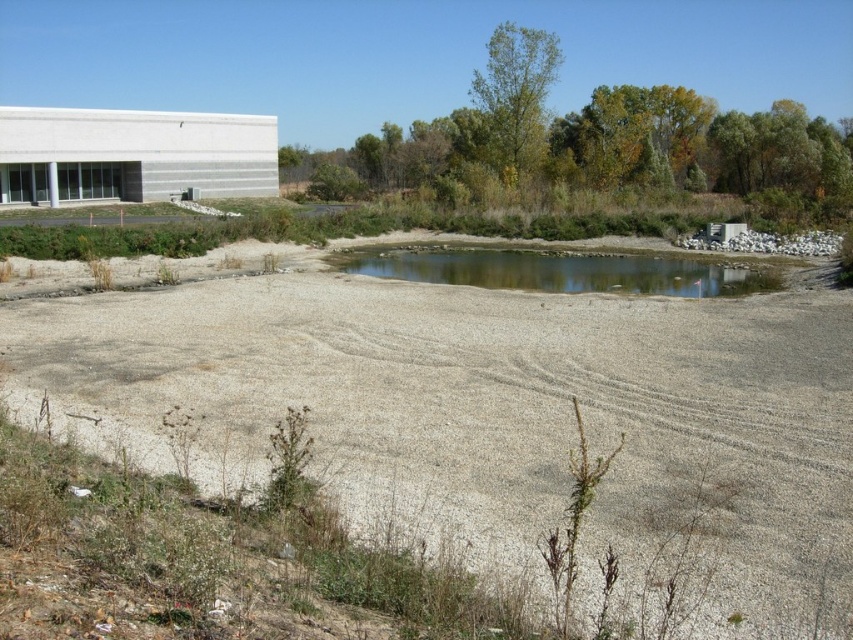
You are a construction worker planning to pour concrete over the gray gravel field at center and clear water at center. Which area requires more preparation because of its height?

The gray gravel field at center requires more preparation because it is much taller than the clear water at center, so leveling it would be necessary before pouring concrete.